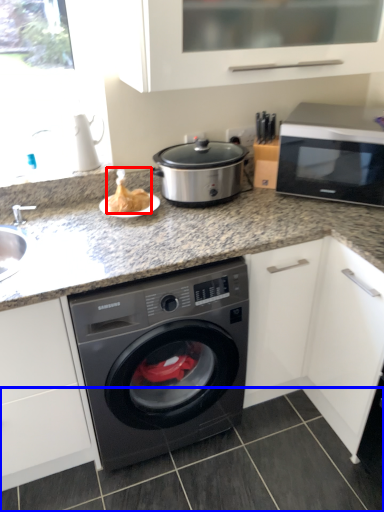
Question: Among these objects, which one is nearest to the camera, food (highlighted by a red box) or tile (highlighted by a blue box)?

Choices:
 (A) food
 (B) tile

Answer: (B)